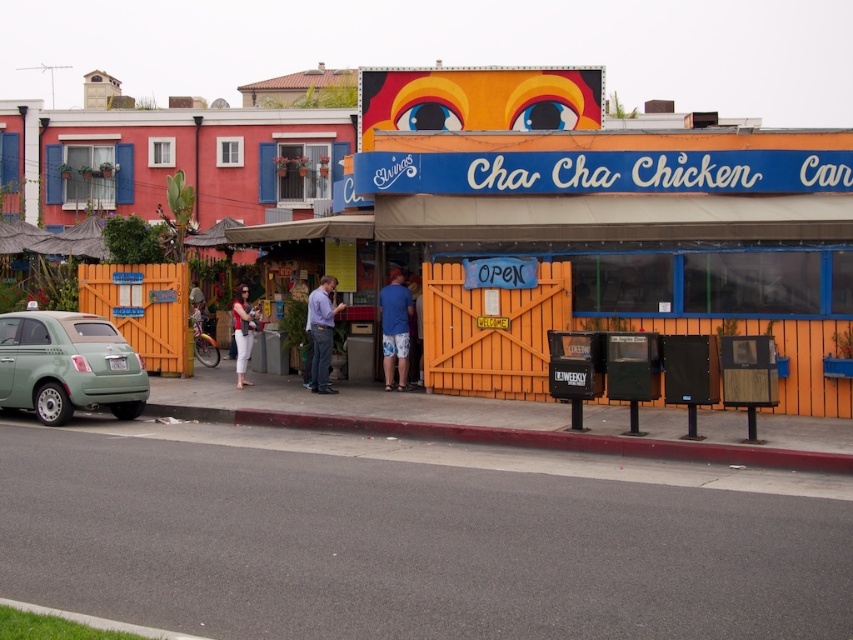
Between blue cotton shorts at center and blue shirt at center, which one appears on the right side from the viewer's perspective?

blue cotton shorts at center is more to the right.

Is blue cotton shorts at center wider than blue shirt at center?

No.

Is point (401, 346) positioned before point (334, 276)?

Yes, it is in front of point (334, 276).

The height and width of the screenshot is (640, 853). In order to click on blue cotton shorts at center in this screenshot , I will do `click(395, 330)`.

Who is shorter, red rubber curb at lower center or matte white pants at center?

red rubber curb at lower center is shorter.

Which is more to the right, red rubber curb at lower center or matte white pants at center?

red rubber curb at lower center is more to the right.

This screenshot has height=640, width=853. In order to click on red rubber curb at lower center in this screenshot , I will do `click(519, 436)`.

You are a GUI agent. You are given a task and a screenshot of the screen. Output one action in this format:
    pyautogui.click(x=<x>, y=<y>)
    Task: Click on the red rubber curb at lower center
    The width and height of the screenshot is (853, 640).
    Given the screenshot: What is the action you would take?
    pyautogui.click(x=519, y=436)

Can you confirm if blue cotton shorts at center is smaller than matte white pants at center?

Indeed, blue cotton shorts at center has a smaller size compared to matte white pants at center.

How far apart are blue cotton shorts at center and matte white pants at center?

The distance of blue cotton shorts at center from matte white pants at center is 2.92 meters.

The width and height of the screenshot is (853, 640). What do you see at coordinates (395, 330) in the screenshot? I see `blue cotton shorts at center` at bounding box center [395, 330].

This screenshot has height=640, width=853. What are the coordinates of `blue cotton shorts at center` in the screenshot? It's located at pos(395,330).